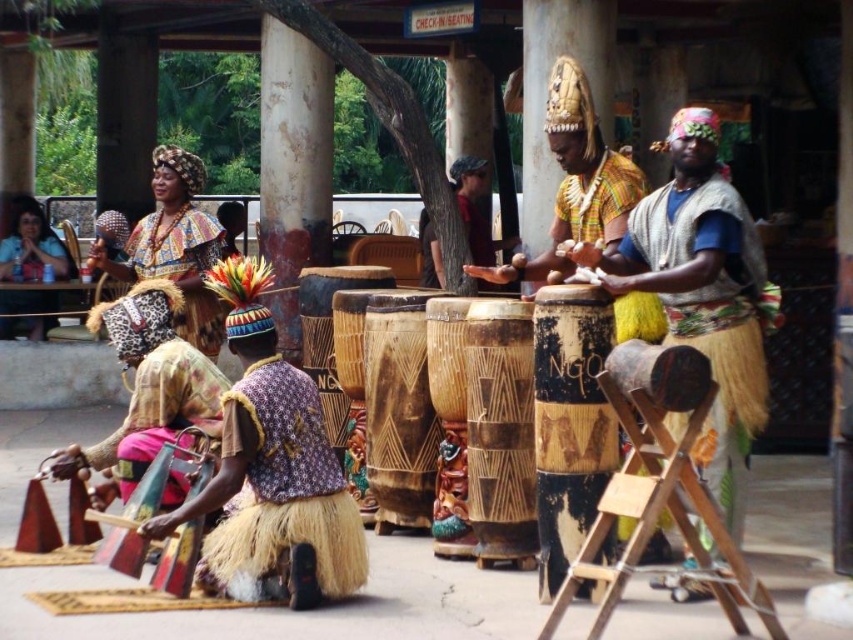
Question: Which object is positioned farthest from the brown textured drum at center?

Choices:
 (A) matte blue shirt at left
 (B) knitted beige vest at center
 (C) natural wood drum at center

Answer: (A)

Question: Which point is closer to the camera?

Choices:
 (A) (756, 396)
 (B) (402, 362)
 (C) (529, 312)

Answer: (A)

Question: Among these points, which one is nearest to the camera?

Choices:
 (A) (595, 344)
 (B) (62, 262)

Answer: (A)

Question: Does black painted wood drum at center appear over natural wood drum at center?

Choices:
 (A) yes
 (B) no

Answer: (B)

Question: Considering the relative positions of brown textured drum at center and matte blue shirt at left in the image provided, where is brown textured drum at center located with respect to matte blue shirt at left?

Choices:
 (A) right
 (B) left

Answer: (A)

Question: Is knitted beige vest at center above matte blue shirt at left?

Choices:
 (A) no
 (B) yes

Answer: (A)